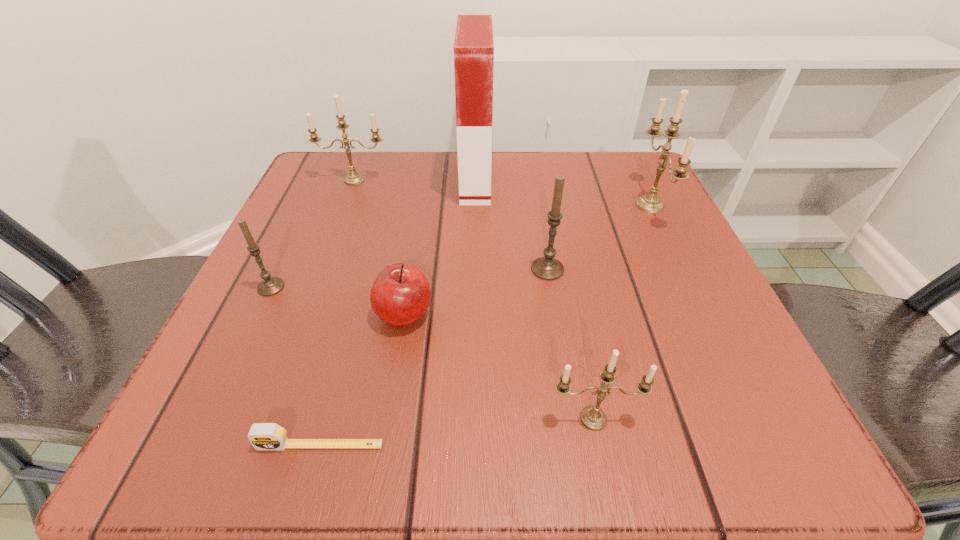
In order to click on free spot at the left edge of the desktop in this screenshot , I will do `click(289, 325)`.

In the image, there is a desktop. Where is `free space at the right edge`? free space at the right edge is located at coordinates (686, 241).

This screenshot has height=540, width=960. Identify the location of free space at the far left corner. (335, 183).

Locate an element on the screen. The width and height of the screenshot is (960, 540). vacant area at the near left corner is located at coordinates (217, 455).

Find the location of `free point at the far right corner`. free point at the far right corner is located at coordinates (611, 213).

Where is `vacant area at the near right corner`? Image resolution: width=960 pixels, height=540 pixels. vacant area at the near right corner is located at coordinates (660, 440).

What are the coordinates of `empty space between the right gray candle and the smallest metallic candle` in the screenshot? It's located at 570,344.

You are a GUI agent. You are given a task and a screenshot of the screen. Output one action in this format:
    pyautogui.click(x=<x>, y=<y>)
    Task: Click on the free space that is in between the second biggest metallic candle and the biggest metallic candle
    The height and width of the screenshot is (540, 960).
    Given the screenshot: What is the action you would take?
    pyautogui.click(x=502, y=192)

Find the location of `free spot between the second shortest object and the leftmost metallic candle`. free spot between the second shortest object and the leftmost metallic candle is located at coordinates (379, 247).

The image size is (960, 540). Find the location of `empty space between the nearest object and the leftmost metallic candle`. empty space between the nearest object and the leftmost metallic candle is located at coordinates (337, 312).